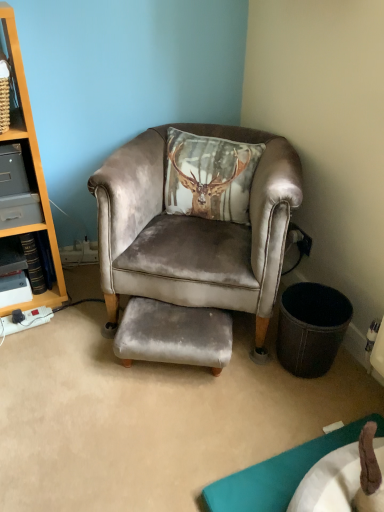
The height and width of the screenshot is (512, 384). In order to click on free space above velvet grey footrest at center (from a real-world perspective) in this screenshot , I will do `click(172, 314)`.